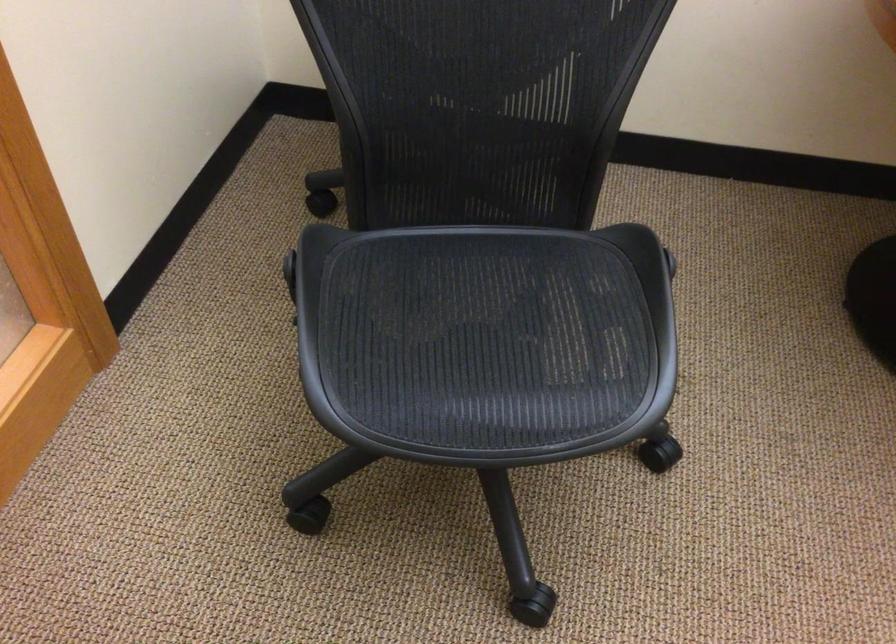
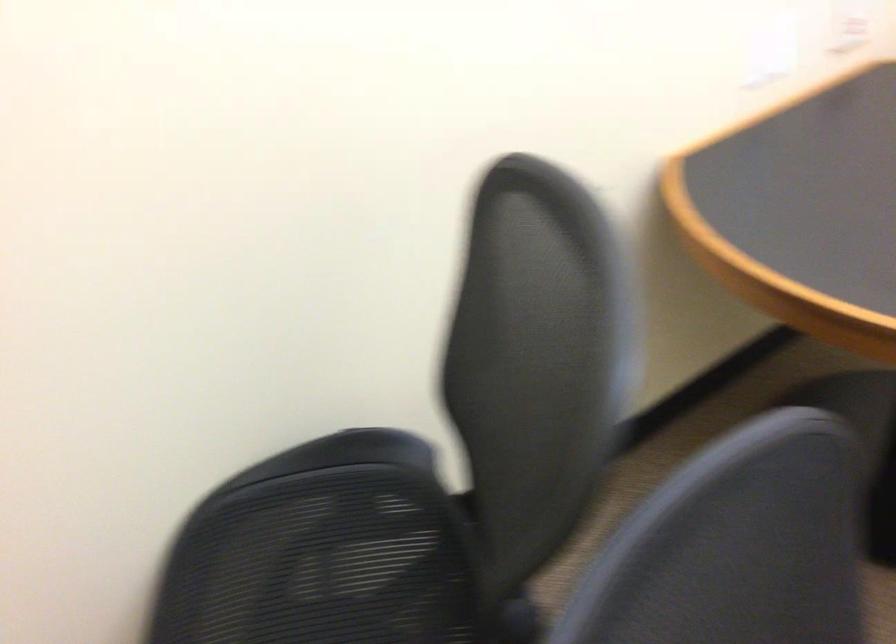
Question: The first image is from the beginning of the video and the second image is from the end. How did the camera likely rotate when shooting the video?

Choices:
 (A) Left
 (B) Right
 (C) Up
 (D) Down

Answer: (B)